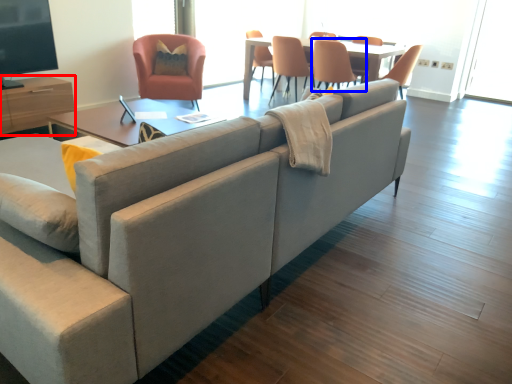
Question: Which of the following is the closest to the observer, entertainment center (highlighted by a red box) or chair (highlighted by a blue box)?

Choices:
 (A) entertainment center
 (B) chair

Answer: (A)